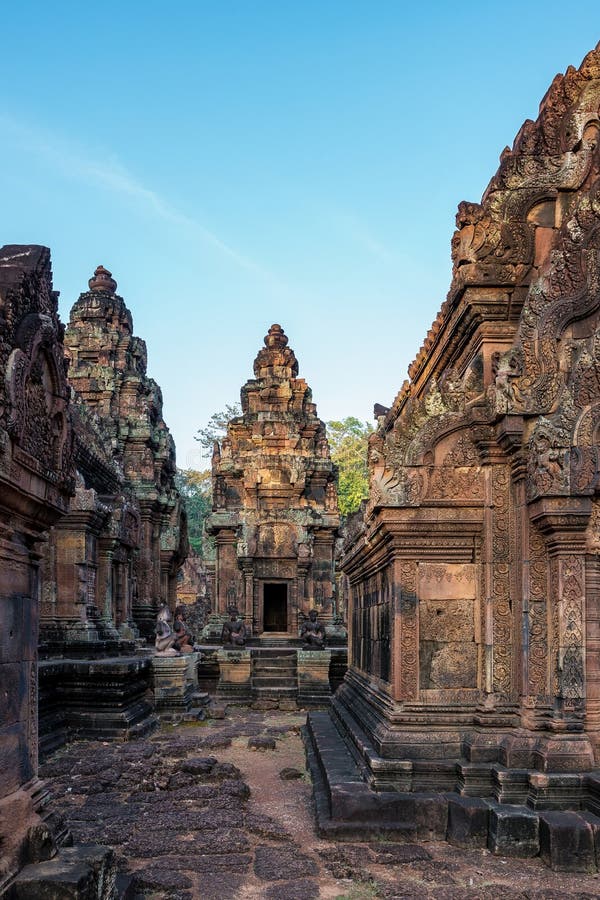
Where is `door`? The image size is (600, 900). door is located at coordinates (277, 605).